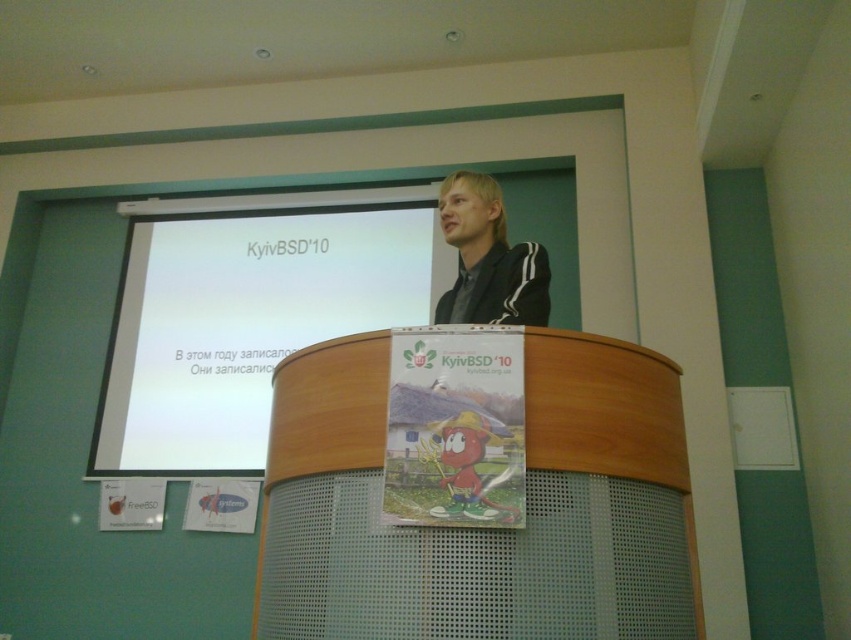
Who is positioned more to the right, wooden podium at center or black matte jacket at upper center?

black matte jacket at upper center is more to the right.

Does wooden podium at center appear on the right side of black matte jacket at upper center?

No, wooden podium at center is not to the right of black matte jacket at upper center.

I want to click on wooden podium at center, so click(483, 529).

Where is `wooden podium at center`? This screenshot has height=640, width=851. wooden podium at center is located at coordinates (483, 529).

Does wooden podium at center have a lesser width compared to white matte projection screen at upper center?

Indeed, wooden podium at center has a lesser width compared to white matte projection screen at upper center.

Does wooden podium at center appear on the right side of white matte projection screen at upper center?

Correct, you'll find wooden podium at center to the right of white matte projection screen at upper center.

You are a GUI agent. You are given a task and a screenshot of the screen. Output one action in this format:
    pyautogui.click(x=<x>, y=<y>)
    Task: Click on the wooden podium at center
    This screenshot has height=640, width=851.
    Given the screenshot: What is the action you would take?
    pyautogui.click(x=483, y=529)

At what (x,y) coordinates should I click in order to perform the action: click on wooden podium at center. Please return your answer as a coordinate pair (x, y). The width and height of the screenshot is (851, 640). Looking at the image, I should click on (483, 529).

Does point (283, 324) come closer to viewer compared to point (535, 289)?

No, (283, 324) is behind (535, 289).

Consider the image. Which of these two, white matte projection screen at upper center or black matte jacket at upper center, stands shorter?

black matte jacket at upper center

Who is more forward, (x=295, y=227) or (x=538, y=264)?

Point (x=538, y=264) is in front.

Locate an element on the screen. This screenshot has width=851, height=640. white matte projection screen at upper center is located at coordinates (248, 314).